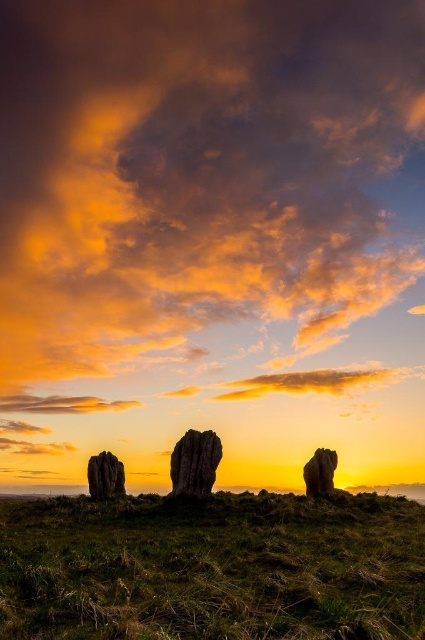
Which is above, rustic stone at center or smooth gray rock at left?

Positioned higher is rustic stone at center.

Does rustic stone at center have a lesser width compared to smooth gray rock at left?

No, rustic stone at center is not thinner than smooth gray rock at left.

Is point (209, 452) more distant than point (118, 493)?

No, it is in front of (118, 493).

Locate an element on the screen. The width and height of the screenshot is (425, 640). rustic stone at center is located at coordinates (195, 461).

Find the location of a particular element. This screenshot has height=640, width=425. green grassy at lower center is located at coordinates (212, 566).

Between green grassy at lower center and smooth stone rock at right, which one is positioned higher?

Positioned higher is green grassy at lower center.

The width and height of the screenshot is (425, 640). What do you see at coordinates (212, 566) in the screenshot?
I see `green grassy at lower center` at bounding box center [212, 566].

The width and height of the screenshot is (425, 640). Identify the location of green grassy at lower center. (212, 566).

Does green grassy at lower center have a larger size compared to rustic stone at center?

Yes, green grassy at lower center is bigger than rustic stone at center.

Can you confirm if green grassy at lower center is thinner than rustic stone at center?

In fact, green grassy at lower center might be wider than rustic stone at center.

Which is in front, point (363, 632) or point (212, 481)?

Point (363, 632) is in front.

At what (x,y) coordinates should I click in order to perform the action: click on green grassy at lower center. Please return your answer as a coordinate pair (x, y). Looking at the image, I should click on (212, 566).